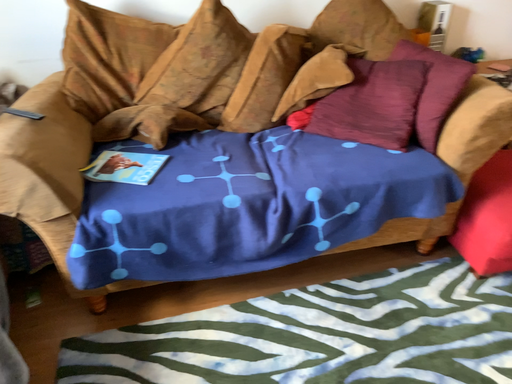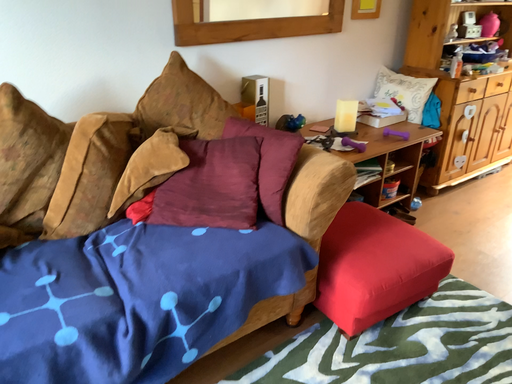
Question: How did the camera likely rotate when shooting the video?

Choices:
 (A) rotated right
 (B) rotated left

Answer: (A)